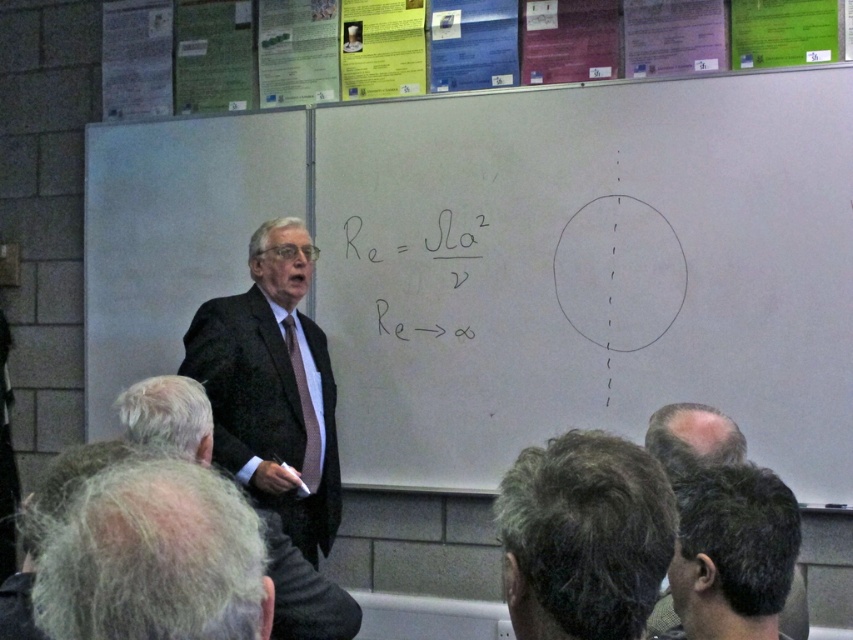
Does gray hair at lower left have a greater height compared to dark brown hair at lower center?

Indeed, gray hair at lower left has a greater height compared to dark brown hair at lower center.

Locate an element on the screen. This screenshot has height=640, width=853. gray hair at lower left is located at coordinates (137, 548).

Where is `gray hair at lower left`? gray hair at lower left is located at coordinates (137, 548).

Measure the distance from black matte text at center to gray hair at lower right.

black matte text at center and gray hair at lower right are 5.16 feet apart from each other.

Is black matte text at center to the left of gray hair at lower right from the viewer's perspective?

Correct, you'll find black matte text at center to the left of gray hair at lower right.

Find the location of `black matte text at center`. black matte text at center is located at coordinates (413, 269).

Does point (247, 438) lie in front of point (694, 410)?

That is False.

Can you confirm if dark suit at center is shorter than gray hair at lower right?

In fact, dark suit at center may be taller than gray hair at lower right.

This screenshot has height=640, width=853. I want to click on dark suit at center, so click(x=271, y=387).